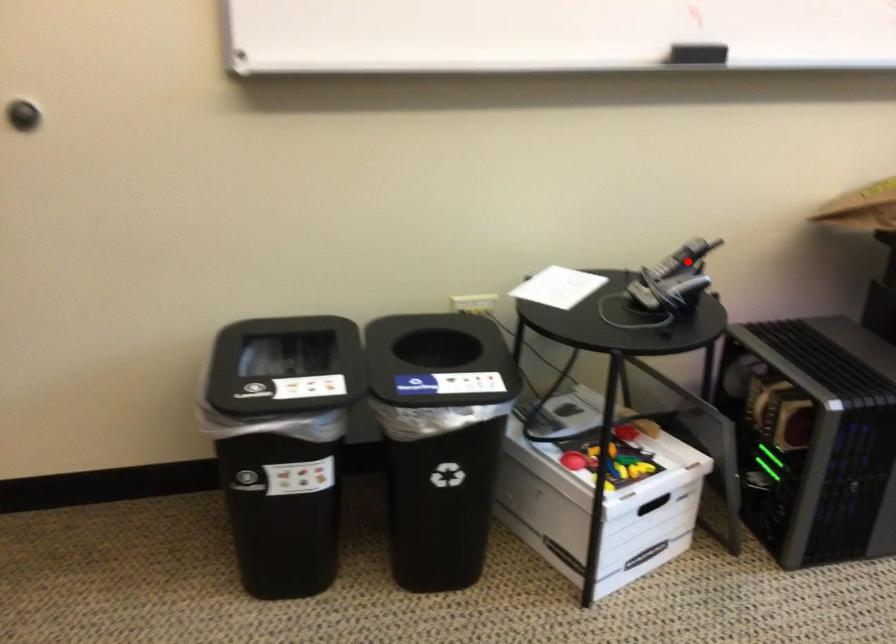
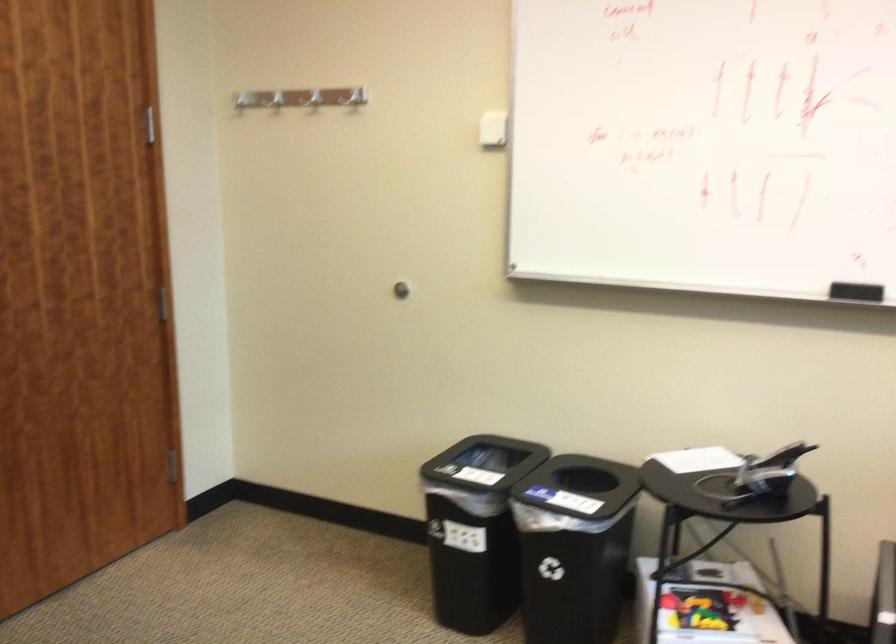
Question: I am providing you with two images of the same scene from different viewpoints. Given a red point in image1, look at the same physical point in image2. Is it:

Choices:
 (A) Closer to the viewpoint
 (B) Farther from the viewpoint

Answer: (B)